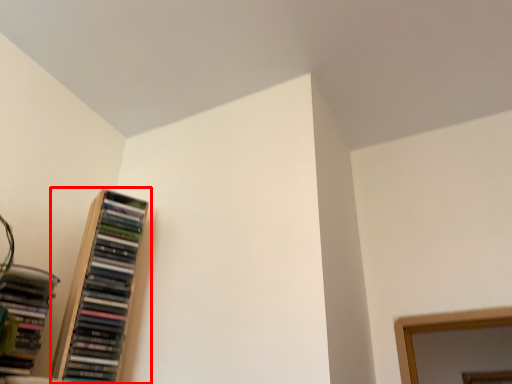
Question: From the image's perspective, where is bookcase (annotated by the red box) located relative to book?

Choices:
 (A) below
 (B) above

Answer: (B)